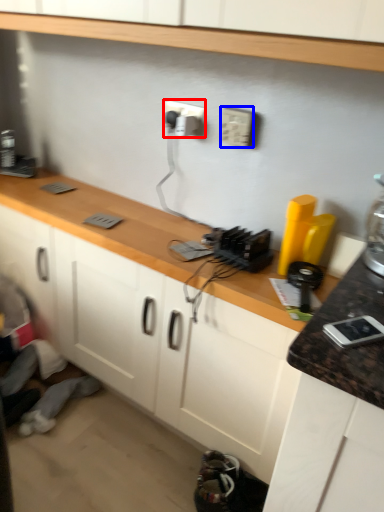
Question: Which object appears farthest to the camera in this image, electric outlet (highlighted by a red box) or electric outlet (highlighted by a blue box)?

Choices:
 (A) electric outlet
 (B) electric outlet

Answer: (A)